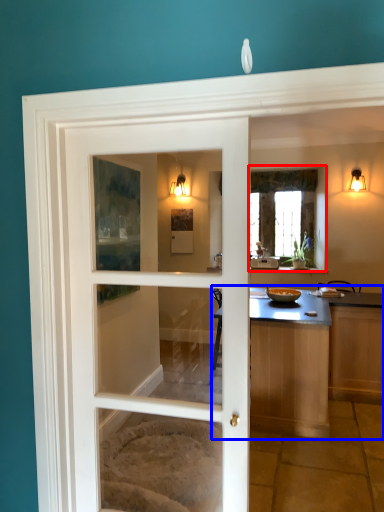
Question: Which object is further to the camera taking this photo, window (highlighted by a red box) or countertop (highlighted by a blue box)?

Choices:
 (A) window
 (B) countertop

Answer: (A)